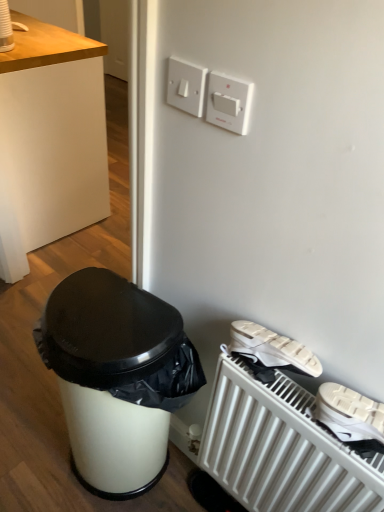
Locate an element on the screen. free space above white glossy trash can at lower left (from a real-world perspective) is located at coordinates (43, 414).